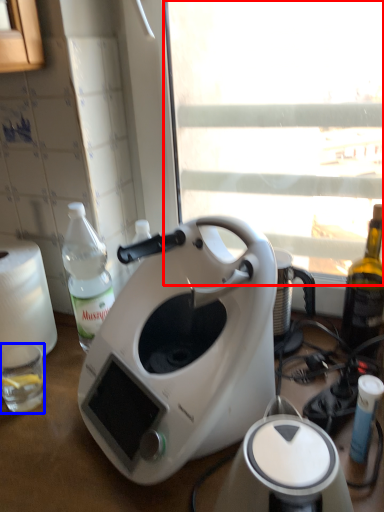
Question: Which of the following is the closest to the observer, window screen (highlighted by a red box) or coffee cup (highlighted by a blue box)?

Choices:
 (A) window screen
 (B) coffee cup

Answer: (A)